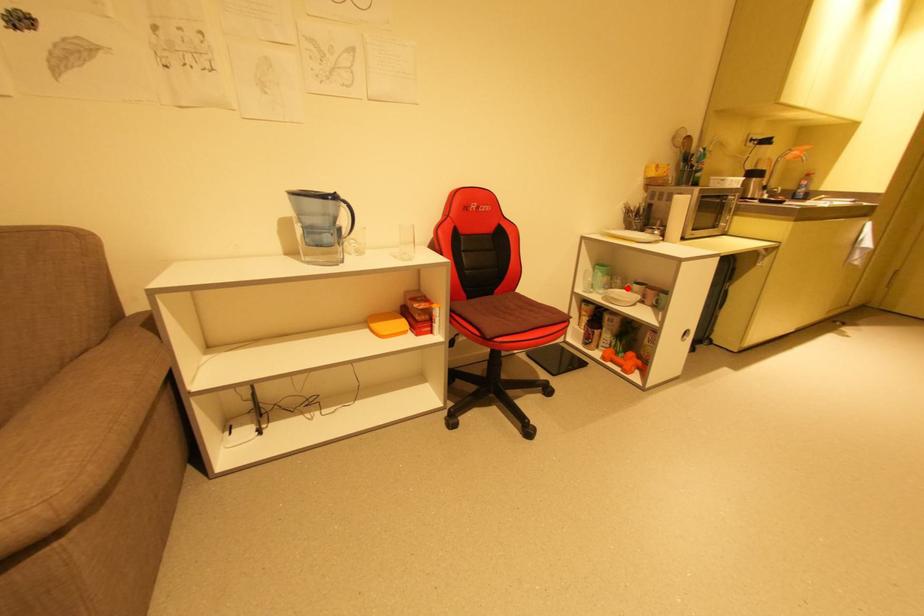
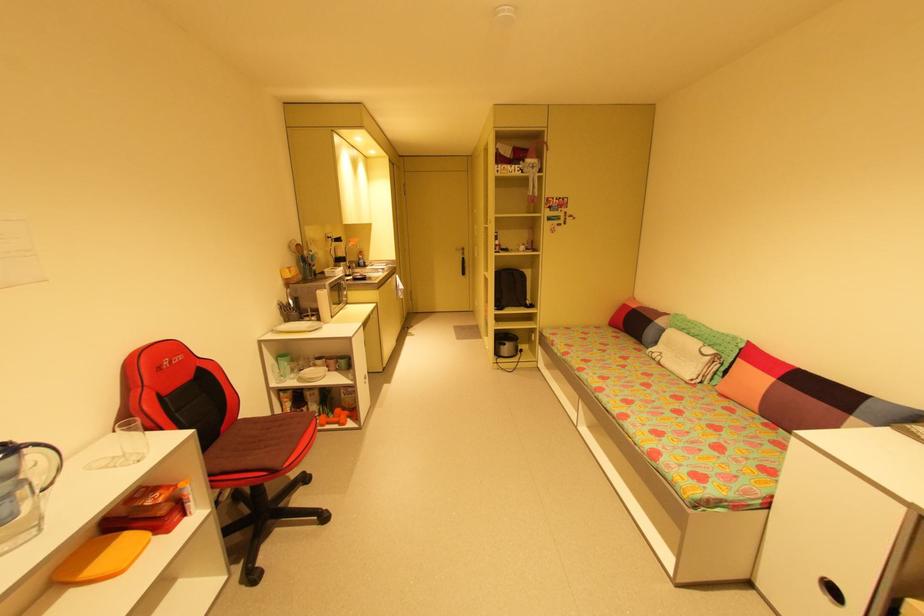
Question: I am providing you with two images of the same scene from different viewpoints. Image1 has a red point marked. In image2, the corresponding 3D location appears at what relative position? Reply with the corresponding letter.

Choices:
 (A) Closer
 (B) Farther

Answer: (B)